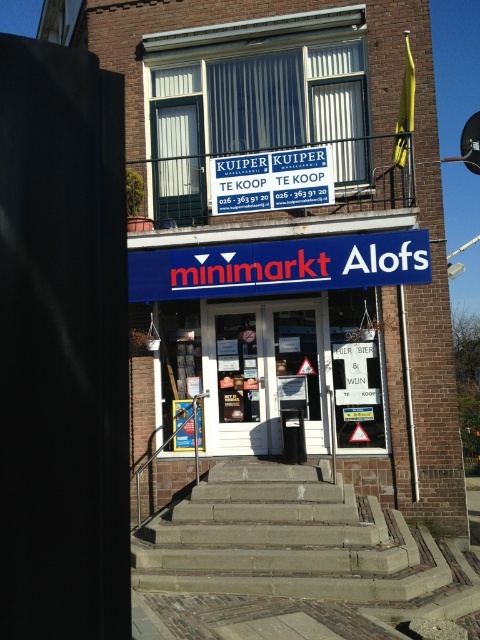
Question: Which point is closer to the camera?

Choices:
 (A) blue plastic sign at upper center
 (B) brown stone stairs at center

Answer: (B)

Question: Which of the following is the farthest from the observer?

Choices:
 (A) (228, 179)
 (B) (255, 563)

Answer: (A)

Question: From the image, what is the correct spatial relationship of brown stone stairs at center in relation to blue plastic sign at upper center?

Choices:
 (A) left
 (B) right

Answer: (B)

Question: Is brown stone stairs at center further to camera compared to blue plastic sign at upper center?

Choices:
 (A) yes
 (B) no

Answer: (B)

Question: Which point is closer to the camera?

Choices:
 (A) (228, 196)
 (B) (402, 588)

Answer: (B)

Question: Can you confirm if brown stone stairs at center is positioned above blue plastic sign at upper center?

Choices:
 (A) no
 (B) yes

Answer: (A)